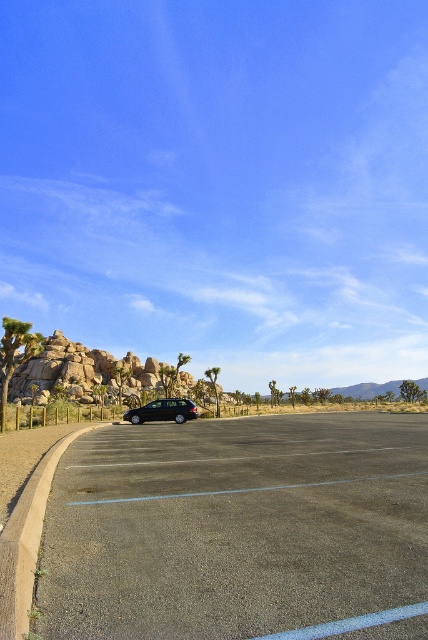
This screenshot has height=640, width=428. Describe the element at coordinates (234, 525) in the screenshot. I see `gray asphalt parking lot at center` at that location.

Does gray asphalt parking lot at center have a greater height compared to black matte car at center?

Yes, gray asphalt parking lot at center is taller than black matte car at center.

Who is more distant from viewer, (365, 444) or (134, 417)?

The point (134, 417) is behind.

You are a GUI agent. You are given a task and a screenshot of the screen. Output one action in this format:
    pyautogui.click(x=<x>, y=<y>)
    Task: Click on the gray asphalt parking lot at center
    
    Given the screenshot: What is the action you would take?
    pyautogui.click(x=234, y=525)